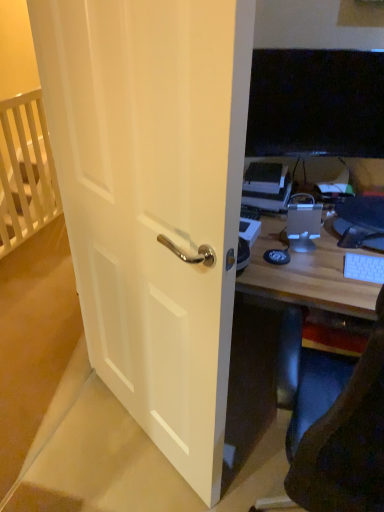
Question: Can black rubber mousepad at center be found inside satin silver desktop at center?

Choices:
 (A) no
 (B) yes

Answer: (A)

Question: Considering the relative positions of satin silver desktop at center and black rubber mousepad at center in the image provided, is satin silver desktop at center to the left of black rubber mousepad at center from the viewer's perspective?

Choices:
 (A) no
 (B) yes

Answer: (A)

Question: Does satin silver desktop at center lie behind black rubber mousepad at center?

Choices:
 (A) no
 (B) yes

Answer: (B)

Question: Is satin silver desktop at center oriented towards black rubber mousepad at center?

Choices:
 (A) no
 (B) yes

Answer: (A)

Question: Is satin silver desktop at center wider than black rubber mousepad at center?

Choices:
 (A) no
 (B) yes

Answer: (A)

Question: From the image's perspective, is satin silver desktop at center under black rubber mousepad at center?

Choices:
 (A) yes
 (B) no

Answer: (B)

Question: Would you say white wooden crib at upper left is part of satin silver desktop at center's contents?

Choices:
 (A) yes
 (B) no

Answer: (B)

Question: Is satin silver desktop at center oriented away from white wooden crib at upper left?

Choices:
 (A) no
 (B) yes

Answer: (A)

Question: Can you confirm if satin silver desktop at center is bigger than white wooden crib at upper left?

Choices:
 (A) yes
 (B) no

Answer: (B)

Question: Considering the relative positions of satin silver desktop at center and white wooden crib at upper left in the image provided, is satin silver desktop at center to the left of white wooden crib at upper left from the viewer's perspective?

Choices:
 (A) no
 (B) yes

Answer: (A)

Question: Is the position of satin silver desktop at center more distant than that of white wooden crib at upper left?

Choices:
 (A) no
 (B) yes

Answer: (A)

Question: Is satin silver desktop at center to the right of white wooden crib at upper left from the viewer's perspective?

Choices:
 (A) yes
 (B) no

Answer: (A)

Question: Is white wooden crib at upper left looking in the opposite direction of white plastic keyboard at right?

Choices:
 (A) yes
 (B) no

Answer: (B)